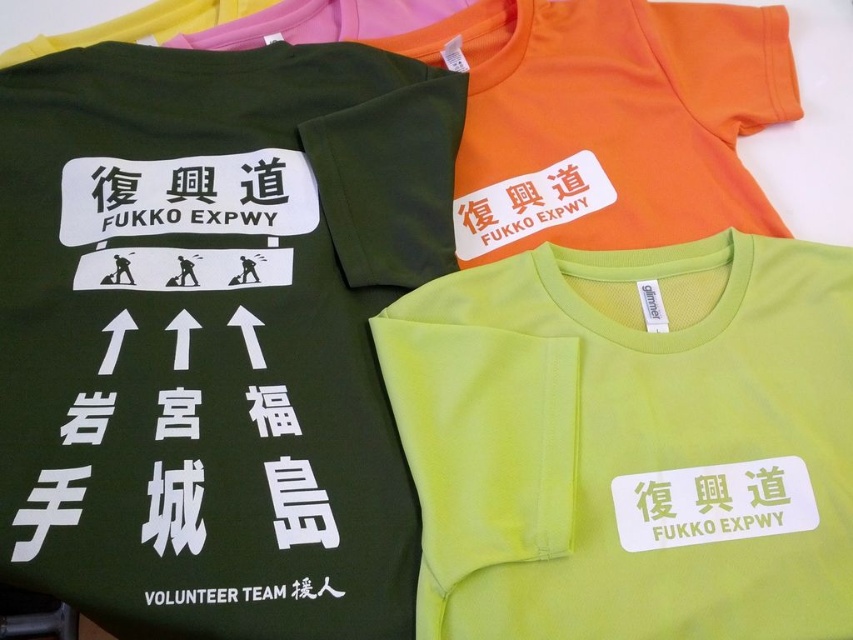
Who is taller, matte green t-shirt at center or lime green t-shirt at center?

Standing taller between the two is matte green t-shirt at center.

Which is in front, point (111, 323) or point (834, 385)?

Point (834, 385) is in front.

This screenshot has height=640, width=853. I want to click on matte green t-shirt at center, so click(215, 332).

This screenshot has width=853, height=640. Identify the location of matte green t-shirt at center. (215, 332).